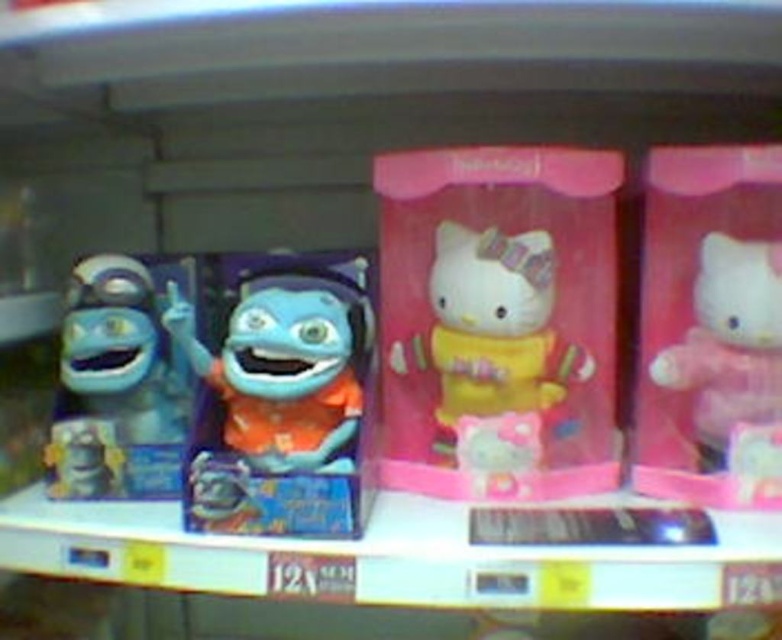
Can you confirm if yellow matte hello kitty at center is wider than pink plush toy at right?

Correct, the width of yellow matte hello kitty at center exceeds that of pink plush toy at right.

Can you confirm if yellow matte hello kitty at center is smaller than pink plush toy at right?

No, yellow matte hello kitty at center is not smaller than pink plush toy at right.

Describe the element at coordinates (492, 333) in the screenshot. Image resolution: width=782 pixels, height=640 pixels. I see `yellow matte hello kitty at center` at that location.

Identify the location of yellow matte hello kitty at center. Image resolution: width=782 pixels, height=640 pixels. (492, 333).

Is the position of yellow matte hello kitty at center more distant than that of matte blue plush toy at left?

That is False.

Is point (479, 387) less distant than point (145, 396)?

Yes, point (479, 387) is closer to viewer.

Identify the location of yellow matte hello kitty at center. The image size is (782, 640). (492, 333).

Which is more to the right, matte blue plush at center or pink plush toy at right?

pink plush toy at right

Locate an element on the screen. The image size is (782, 640). matte blue plush at center is located at coordinates (289, 364).